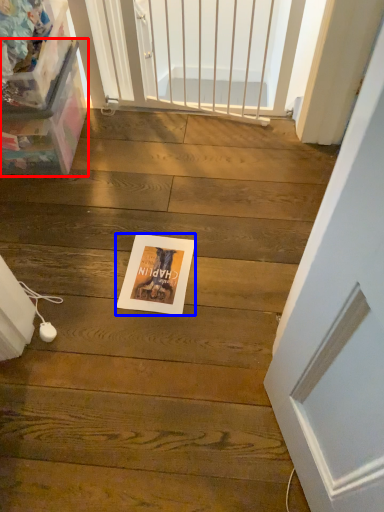
Question: Which of the following is the closest to the observer, box (highlighted by a red box) or postcard (highlighted by a blue box)?

Choices:
 (A) box
 (B) postcard

Answer: (A)